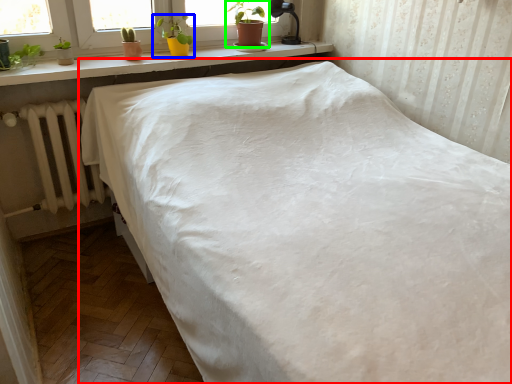
Question: Which object is the closest to the bed (highlighted by a red box)? Choose among these: houseplant (highlighted by a blue box) or houseplant (highlighted by a green box).

Choices:
 (A) houseplant
 (B) houseplant

Answer: (A)